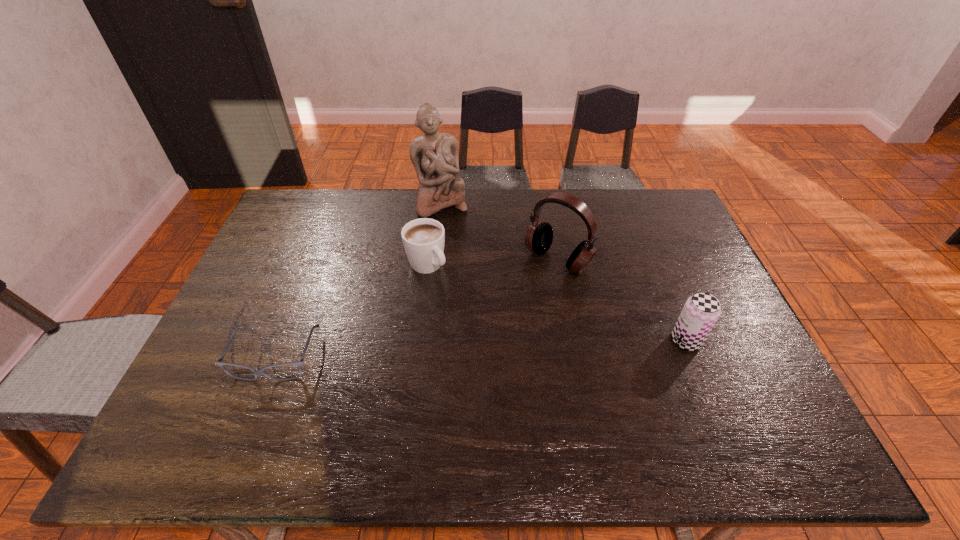
You are a GUI agent. You are given a task and a screenshot of the screen. Output one action in this format:
    pyautogui.click(x=<x>, y=<y>)
    Task: Click on the shortest object
    
    Given the screenshot: What is the action you would take?
    pyautogui.click(x=299, y=364)

Where is `the leftmost object`? The height and width of the screenshot is (540, 960). the leftmost object is located at coordinates (299, 364).

The image size is (960, 540). In order to click on beer can in this screenshot , I will do `click(701, 311)`.

The height and width of the screenshot is (540, 960). I want to click on the rightmost object, so click(701, 311).

Locate an element on the screen. This screenshot has height=540, width=960. the second object from right to left is located at coordinates (539, 236).

Identify the location of the fourth shortest object. (539, 236).

At what (x,y) coordinates should I click in order to perform the action: click on the tallest object. Please return your answer as a coordinate pair (x, y). This screenshot has width=960, height=540. Looking at the image, I should click on click(434, 155).

At what (x,y) coordinates should I click in order to perform the action: click on figurine. Please return your answer as a coordinate pair (x, y). The height and width of the screenshot is (540, 960). Looking at the image, I should click on (434, 155).

This screenshot has height=540, width=960. Find the location of `cappuccino`. cappuccino is located at coordinates (423, 239).

Locate an element on the screen. The image size is (960, 540). free region located on the back of the rightmost object is located at coordinates [x=676, y=314].